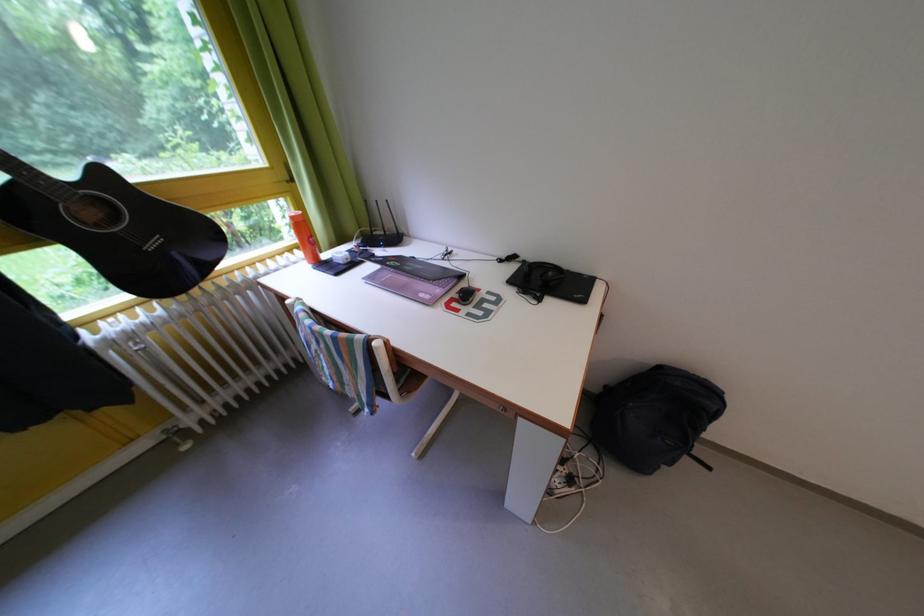
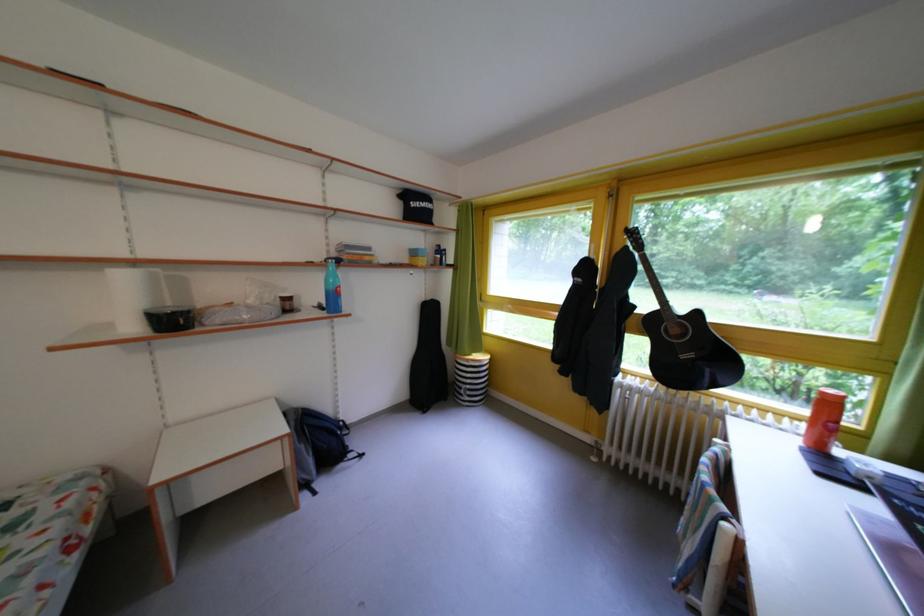
Find the pixel in the second image that matches [112,179] in the first image.

(707, 320)